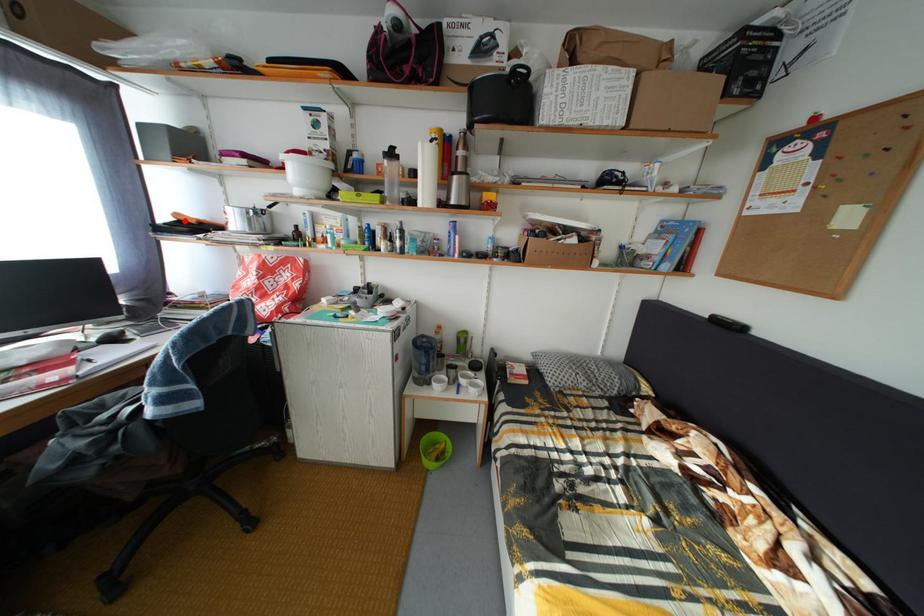
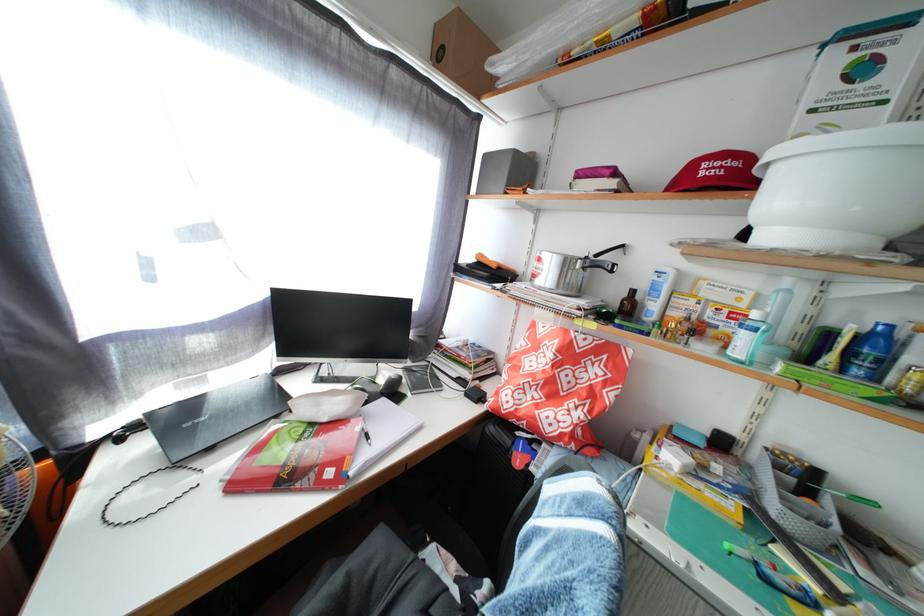
Question: I am providing you with two images of the same scene from different viewpoints. A red point is marked on the first image. Can you still see the location of the red point in image 2?

Choices:
 (A) Yes
 (B) No

Answer: (A)